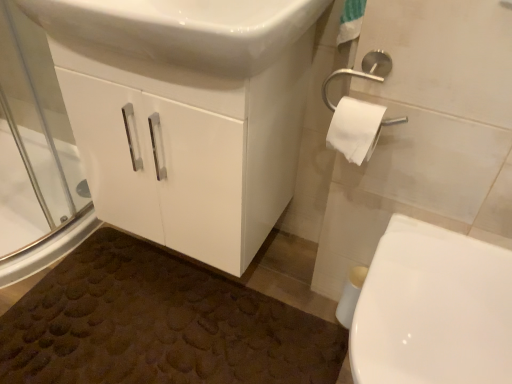
Question: From a real-world perspective, is white glossy cabinet at center positioned over white glossy toilet at lower right based on gravity?

Choices:
 (A) yes
 (B) no

Answer: (A)

Question: From the image's perspective, is white glossy cabinet at center on white glossy toilet at lower right?

Choices:
 (A) yes
 (B) no

Answer: (A)

Question: Is white glossy cabinet at center completely or partially outside of white glossy toilet at lower right?

Choices:
 (A) yes
 (B) no

Answer: (A)

Question: Considering the relative sizes of white glossy cabinet at center and white glossy toilet at lower right in the image provided, is white glossy cabinet at center smaller than white glossy toilet at lower right?

Choices:
 (A) no
 (B) yes

Answer: (A)

Question: Considering the relative sizes of white glossy cabinet at center and white glossy toilet at lower right in the image provided, is white glossy cabinet at center bigger than white glossy toilet at lower right?

Choices:
 (A) no
 (B) yes

Answer: (B)

Question: Would you say white glossy sink at upper center is inside or outside white glossy toilet at lower right?

Choices:
 (A) outside
 (B) inside

Answer: (A)

Question: Does point (211, 66) appear closer or farther from the camera than point (400, 357)?

Choices:
 (A) farther
 (B) closer

Answer: (A)

Question: Is white glossy sink at upper center wider or thinner than white glossy toilet at lower right?

Choices:
 (A) thin
 (B) wide

Answer: (A)

Question: Relative to white glossy toilet at lower right, is white glossy sink at upper center in front or behind?

Choices:
 (A) behind
 (B) front

Answer: (A)

Question: Based on their positions, is white glossy toilet at lower right located to the left or right of white glossy cabinet at center?

Choices:
 (A) left
 (B) right

Answer: (B)

Question: From a real-world perspective, relative to white glossy cabinet at center, is white glossy toilet at lower right vertically above or below?

Choices:
 (A) above
 (B) below

Answer: (B)

Question: Considering the positions of white glossy toilet at lower right and white glossy cabinet at center in the image, is white glossy toilet at lower right taller or shorter than white glossy cabinet at center?

Choices:
 (A) short
 (B) tall

Answer: (A)

Question: Considering the positions of white glossy toilet at lower right and white glossy cabinet at center in the image, is white glossy toilet at lower right wider or thinner than white glossy cabinet at center?

Choices:
 (A) thin
 (B) wide

Answer: (B)

Question: From a real-world perspective, is white glossy cabinet at center positioned above or below transparent glass screen door at left?

Choices:
 (A) below
 (B) above

Answer: (B)

Question: Based on their sizes in the image, would you say white glossy cabinet at center is bigger or smaller than transparent glass screen door at left?

Choices:
 (A) big
 (B) small

Answer: (A)